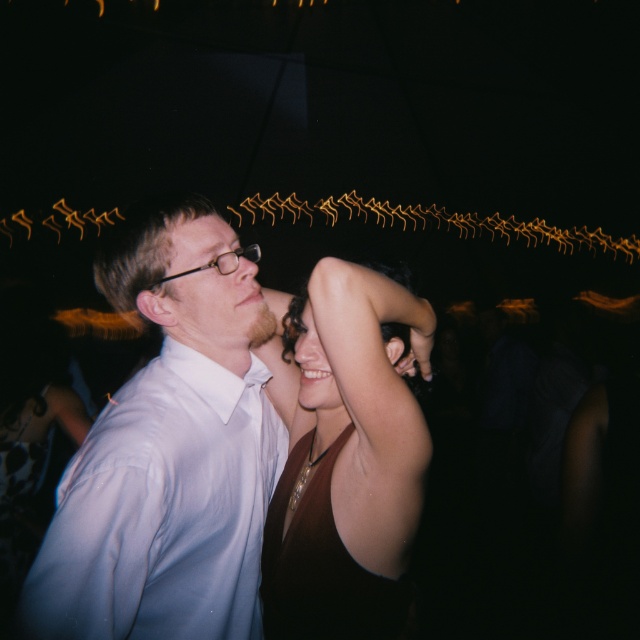
Looking at this image, does white glossy shirt at center come in front of matte brown dress at center?

That is False.

Between white glossy shirt at center and matte brown dress at center, which one has more height?

white glossy shirt at center

Does point (264, 497) come farther from viewer compared to point (358, 381)?

Yes, point (264, 497) is behind point (358, 381).

What are the coordinates of `white glossy shirt at center` in the screenshot? It's located at (168, 456).

Does matte brown dress at center appear under satin burgundy dress at center?

Actually, matte brown dress at center is above satin burgundy dress at center.

Between point (300, 500) and point (269, 598), which one is positioned in front?

Point (300, 500) is more forward.

Find the location of a particular element. matte brown dress at center is located at coordinates (346, 460).

Does smooth skin at center have a smaller size compared to matte skin at center?

No, smooth skin at center is not smaller than matte skin at center.

I want to click on smooth skin at center, so click(314, 369).

Who is more distant from viewer, (x=310, y=410) or (x=205, y=248)?

Positioned behind is point (x=310, y=410).

Identify the location of smooth skin at center. (314, 369).